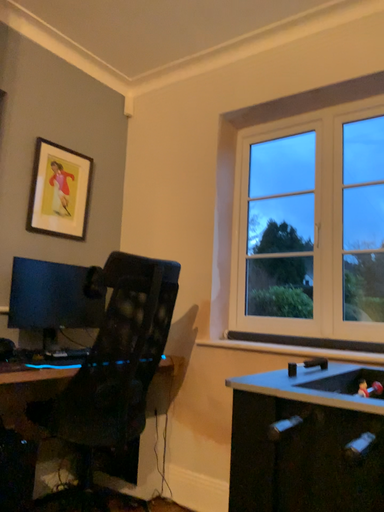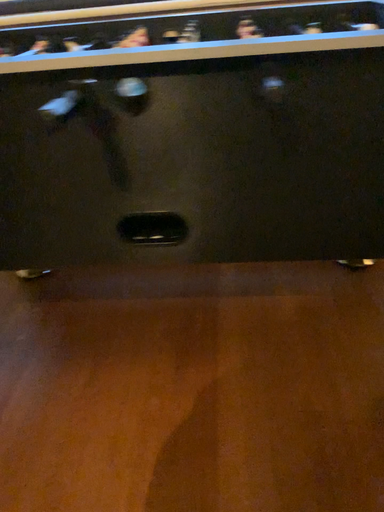
Question: How did the camera likely rotate when shooting the video?

Choices:
 (A) rotated upward
 (B) rotated downward

Answer: (B)